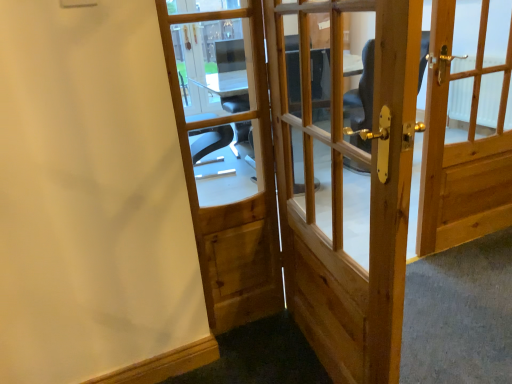
Question: From a real-world perspective, is natural wood door at right, which is the first door from right to left, positioned above or below natural wood door at center, the 2th door when ordered from right to left?

Choices:
 (A) above
 (B) below

Answer: (B)

Question: Looking at their shapes, would you say natural wood door at right, the 3th door when ordered from left to right, is wider or thinner than natural wood door at center, the 2th door when ordered from right to left?

Choices:
 (A) wide
 (B) thin

Answer: (A)

Question: Which object is the farthest from the natural wood door at right, the 3th door when ordered from left to right?

Choices:
 (A) natural wood door at center, the 2th door when ordered from right to left
 (B) natural wood door at center, which is counted as the third door, starting from the right

Answer: (B)

Question: Which object is positioned closest to the natural wood door at center, which is counted as the third door, starting from the right?

Choices:
 (A) natural wood door at right, which is the first door from right to left
 (B) natural wood door at center, which appears as the 2th door when viewed from the left

Answer: (B)